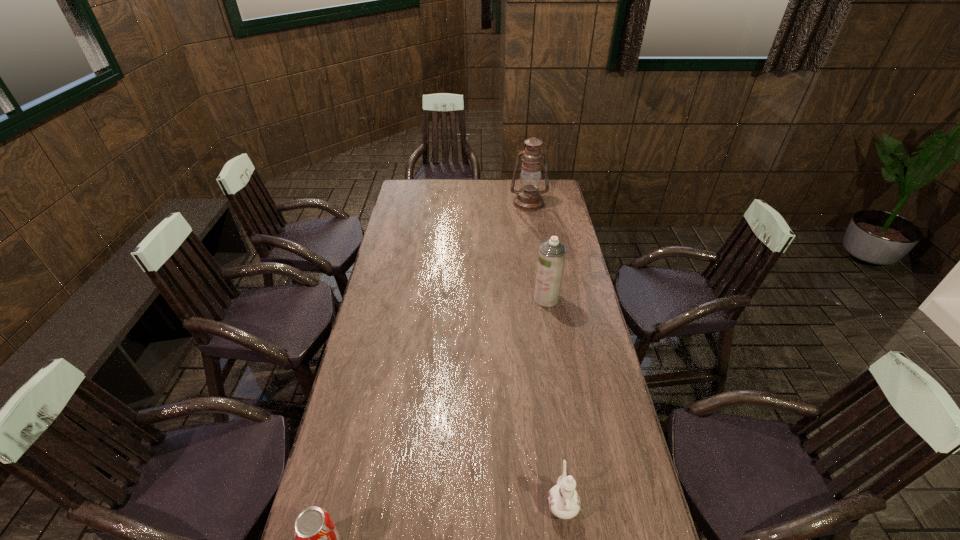
This screenshot has height=540, width=960. I want to click on object that is at the far edge, so click(x=528, y=198).

Image resolution: width=960 pixels, height=540 pixels. Find the location of `oil lamp that is at the right edge`. oil lamp that is at the right edge is located at coordinates (528, 198).

Where is `aerosol can situated at the right edge`? This screenshot has height=540, width=960. aerosol can situated at the right edge is located at coordinates (552, 253).

Where is `object situated at the far right corner`? This screenshot has height=540, width=960. object situated at the far right corner is located at coordinates (528, 198).

This screenshot has width=960, height=540. In the image, there is a desktop. In order to click on free region at the far edge in this screenshot , I will do `click(443, 197)`.

In the image, there is a desktop. At what (x,y) coordinates should I click in order to perform the action: click on vacant space at the left edge. Please return your answer as a coordinate pair (x, y). Looking at the image, I should click on (416, 246).

You are a GUI agent. You are given a task and a screenshot of the screen. Output one action in this format:
    pyautogui.click(x=<x>, y=<y>)
    Task: Click on the vacant space at the right edge of the desktop
    This screenshot has height=540, width=960.
    Given the screenshot: What is the action you would take?
    pyautogui.click(x=617, y=537)

Where is `vacant area at the far left corner`? The height and width of the screenshot is (540, 960). vacant area at the far left corner is located at coordinates (410, 185).

Locate an element on the screen. vacant area that lies between the third shortest object and the chinaware is located at coordinates (554, 401).

Where is `empty location between the second farthest object and the farthest object`? empty location between the second farthest object and the farthest object is located at coordinates (538, 251).